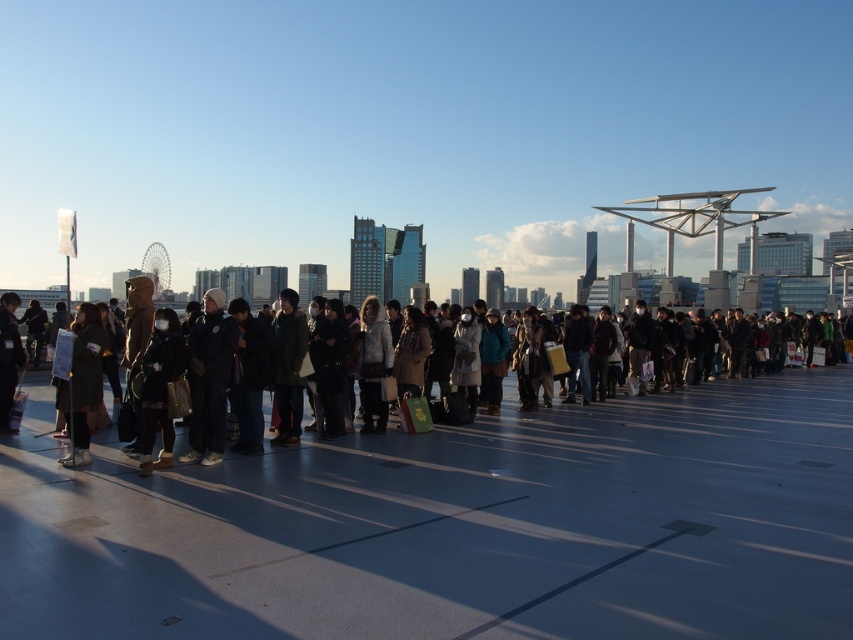
Does dark green fabric coat at left have a lesser height compared to dark gray jacket at left?

Yes.

Who is positioned more to the right, dark green fabric coat at left or dark gray jacket at left?

dark green fabric coat at left

Identify the location of dark green fabric coat at left. This screenshot has height=640, width=853. (82, 381).

Locate an element on the screen. Image resolution: width=853 pixels, height=640 pixels. dark green fabric coat at left is located at coordinates 82,381.

Between dark gray fabric jacket at center and dark green fabric coat at left, which one is positioned higher?

dark gray fabric jacket at center is higher up.

Locate an element on the screen. The height and width of the screenshot is (640, 853). dark gray fabric jacket at center is located at coordinates [x=209, y=378].

Find the location of a particular element. Image resolution: width=853 pixels, height=640 pixels. dark gray fabric jacket at center is located at coordinates (209, 378).

Is dark gray coat at center shorter than dark gray fabric jacket at center?

Indeed, dark gray coat at center has a lesser height compared to dark gray fabric jacket at center.

Does dark gray coat at center have a larger size compared to dark gray fabric jacket at center?

Yes.

Between point (508, 397) and point (198, 442), which one is positioned behind?

The point (508, 397) is more distant.

I want to click on dark gray coat at center, so click(x=476, y=509).